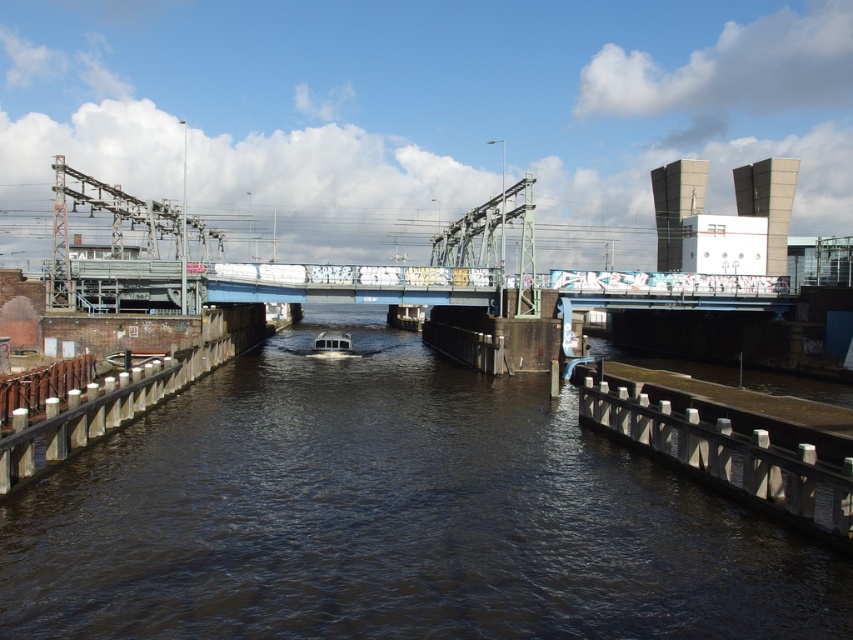
Question: Estimate the real-world distances between objects in this image. Which object is closer to the metallic gray dock at lower right?

Choices:
 (A) white matte boat at center
 (B) wooden dock at left
 (C) dark brown water at center

Answer: (C)

Question: Can you confirm if wooden dock at left is thinner than white matte boat at center?

Choices:
 (A) no
 (B) yes

Answer: (A)

Question: Which point appears farthest from the camera in this image?

Choices:
 (A) (194, 365)
 (B) (286, 336)

Answer: (B)

Question: Which of the following is the closest to the observer?

Choices:
 (A) (341, 353)
 (B) (622, 429)
 (C) (132, 387)

Answer: (B)

Question: Where is dark brown water at center located in relation to wooden dock at left in the image?

Choices:
 (A) left
 (B) right

Answer: (B)

Question: Does dark brown water at center appear on the right side of wooden dock at left?

Choices:
 (A) no
 (B) yes

Answer: (B)